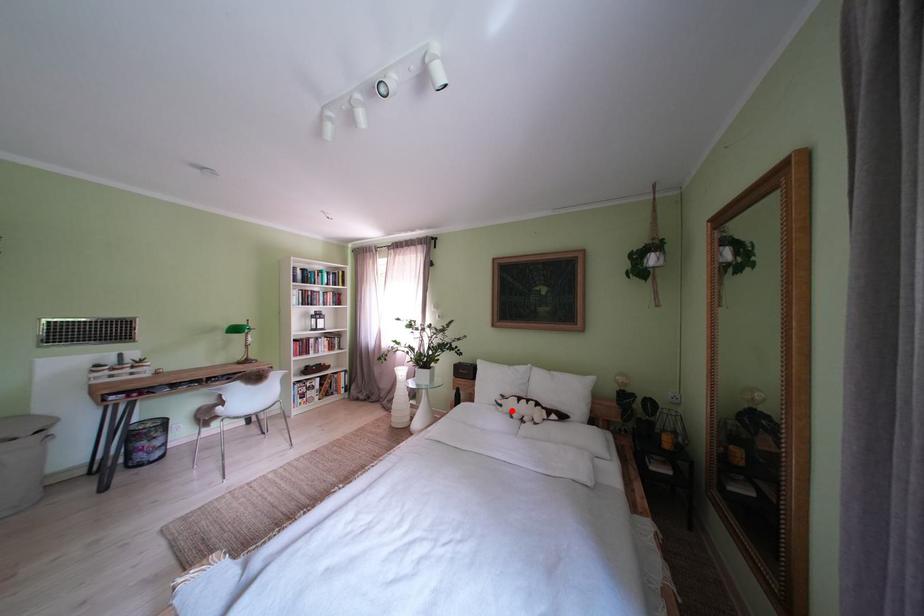
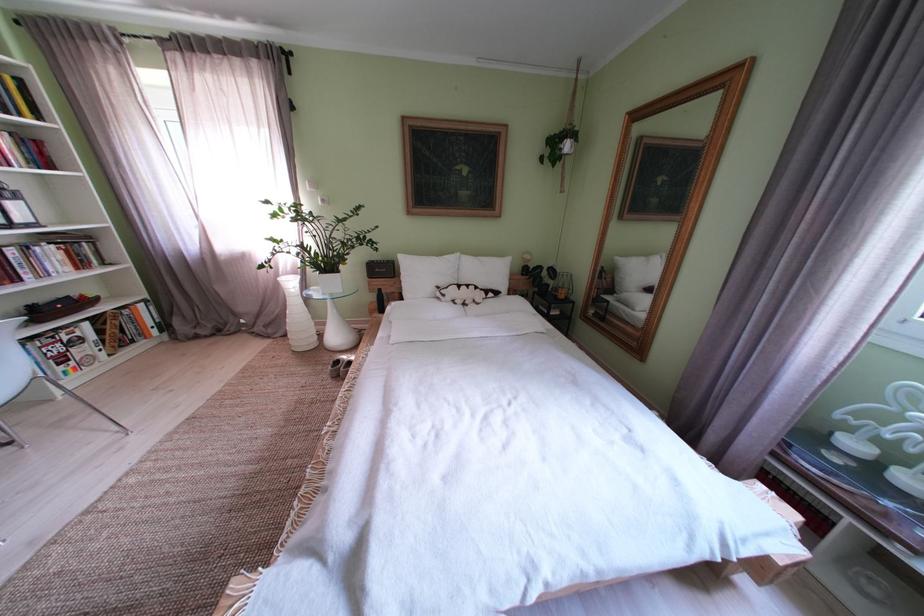
Question: I am providing you with two images of the same scene from different viewpoints. A red point is shown in image1. For the corresponding object point in image2, is it positioned nearer or farther from the camera?

Choices:
 (A) Nearer
 (B) Farther

Answer: (A)